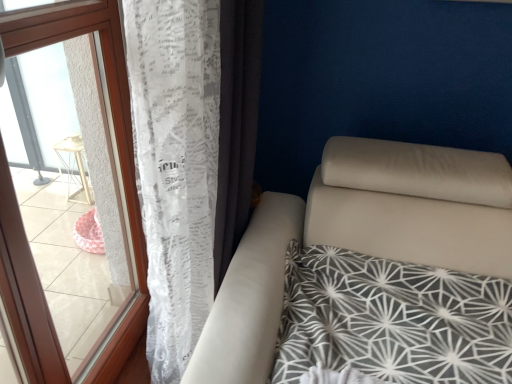
Question: Is transparent plastic window at left not inside white lace curtain at left, which is the second curtain in left-to-right order?

Choices:
 (A) yes
 (B) no

Answer: (A)

Question: Is white lace curtain at left, which is the second curtain in left-to-right order, completely or partially inside transparent plastic window at left?

Choices:
 (A) no
 (B) yes

Answer: (A)

Question: From a real-world perspective, is transparent plastic window at left below white lace curtain at left, which is the second curtain in left-to-right order?

Choices:
 (A) no
 (B) yes

Answer: (B)

Question: Does transparent plastic window at left have a larger size compared to white lace curtain at left, the first curtain positioned from the right?

Choices:
 (A) no
 (B) yes

Answer: (B)

Question: From the image's perspective, would you say transparent plastic window at left is shown under white lace curtain at left, which is the second curtain in left-to-right order?

Choices:
 (A) no
 (B) yes

Answer: (B)

Question: Is transparent plastic window at left taller than white lace curtain at left, which is the second curtain in left-to-right order?

Choices:
 (A) no
 (B) yes

Answer: (B)

Question: Is white lace curtain at left, which is the second curtain in left-to-right order, facing away from white lace curtain at left, which ranks as the second curtain in right-to-left order?

Choices:
 (A) no
 (B) yes

Answer: (A)

Question: From a real-world perspective, does white lace curtain at left, which is the second curtain in left-to-right order, sit lower than white lace curtain at left, which ranks as the second curtain in right-to-left order?

Choices:
 (A) no
 (B) yes

Answer: (A)

Question: Does white lace curtain at left, which is the second curtain in left-to-right order, come in front of white lace curtain at left, which ranks as the second curtain in right-to-left order?

Choices:
 (A) yes
 (B) no

Answer: (B)

Question: Considering the relative sizes of white lace curtain at left, the first curtain positioned from the right, and white lace curtain at left, positioned as the first curtain in left-to-right order, in the image provided, is white lace curtain at left, the first curtain positioned from the right, bigger than white lace curtain at left, positioned as the first curtain in left-to-right order,?

Choices:
 (A) yes
 (B) no

Answer: (B)

Question: From the image's perspective, would you say white lace curtain at left, the first curtain positioned from the right, is shown under white lace curtain at left, positioned as the first curtain in left-to-right order?

Choices:
 (A) no
 (B) yes

Answer: (A)

Question: Is white lace curtain at left, the first curtain positioned from the right, oriented towards white lace curtain at left, which ranks as the second curtain in right-to-left order?

Choices:
 (A) no
 (B) yes

Answer: (A)

Question: Can you confirm if white lace curtain at left, which ranks as the second curtain in right-to-left order, is thinner than transparent plastic window at left?

Choices:
 (A) yes
 (B) no

Answer: (B)